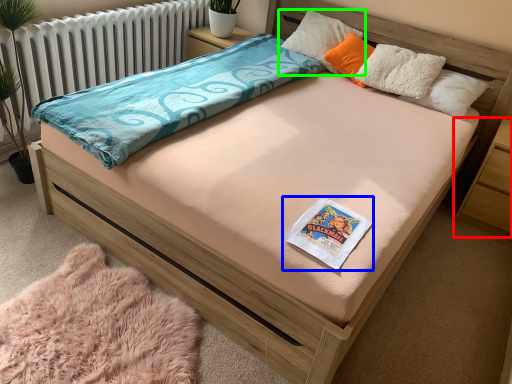
Question: Considering the real-world distances, which object is closest to nightstand (highlighted by a red box)? book (highlighted by a blue box) or pillow (highlighted by a green box).

Choices:
 (A) book
 (B) pillow

Answer: (B)